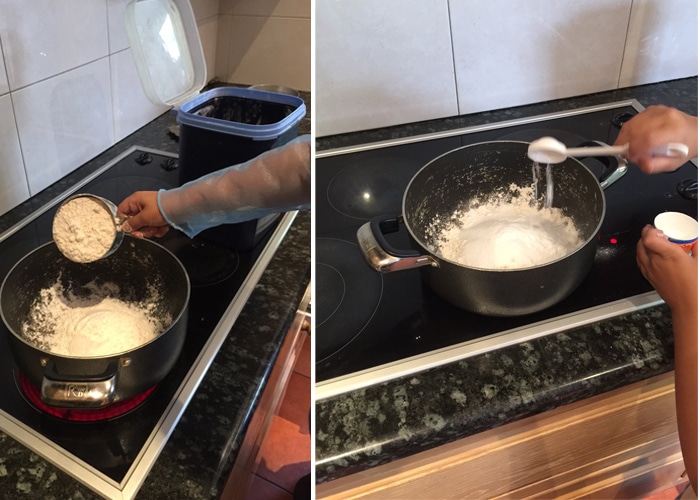
Locate an element on the screen. wall is located at coordinates (550, 34).